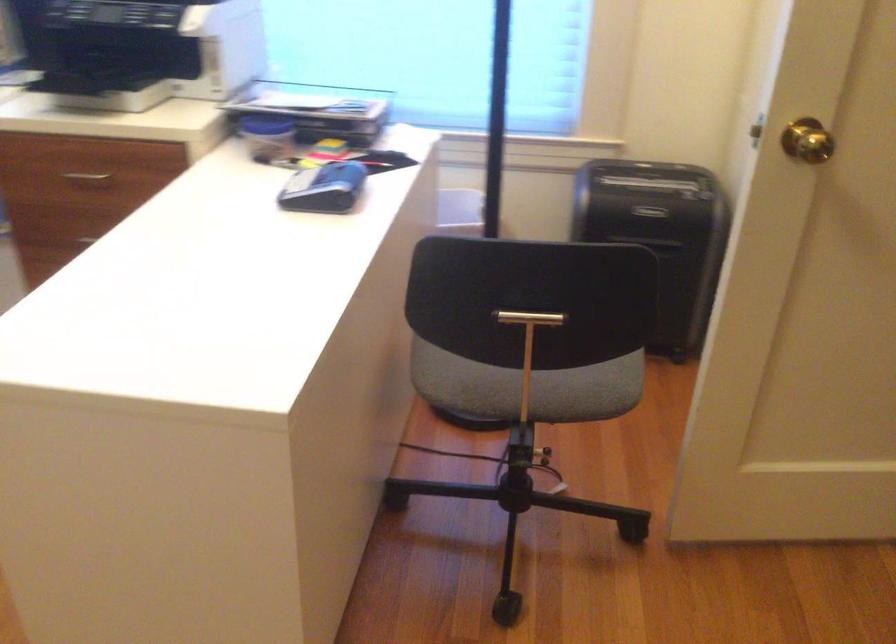
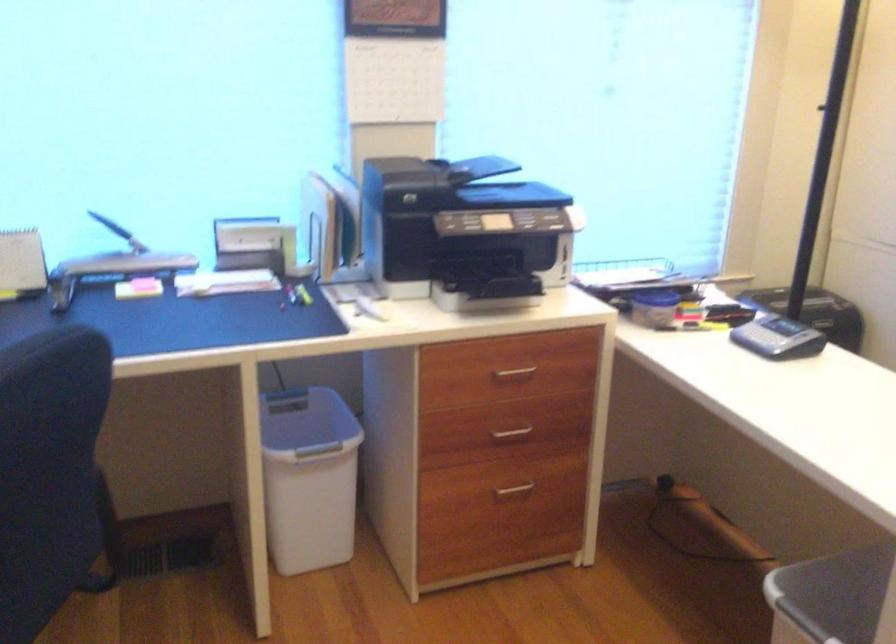
In the second image, find the point that corresponds to (97,180) in the first image.

(513, 374)